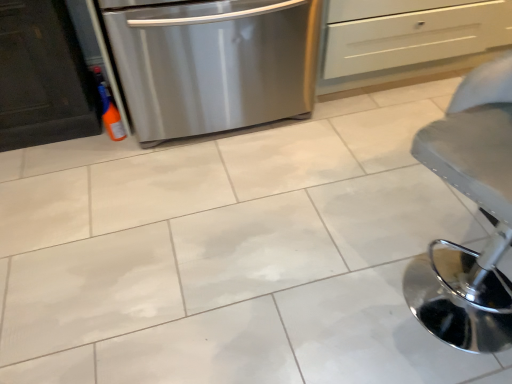
Question: Does metallic gray stool at lower right have a larger size compared to white matte drawer at upper center?

Choices:
 (A) no
 (B) yes

Answer: (A)

Question: From a real-world perspective, does metallic gray stool at lower right stand above white matte drawer at upper center?

Choices:
 (A) no
 (B) yes

Answer: (B)

Question: Is metallic gray stool at lower right oriented towards white matte drawer at upper center?

Choices:
 (A) no
 (B) yes

Answer: (A)

Question: Is metallic gray stool at lower right not within white matte drawer at upper center?

Choices:
 (A) no
 (B) yes

Answer: (B)

Question: Is metallic gray stool at lower right in front of white matte drawer at upper center?

Choices:
 (A) no
 (B) yes

Answer: (B)

Question: In terms of width, does stainless steel dishwasher at left look wider or thinner when compared to metallic gray stool at lower right?

Choices:
 (A) wide
 (B) thin

Answer: (A)

Question: From a real-world perspective, is stainless steel dishwasher at left above or below metallic gray stool at lower right?

Choices:
 (A) above
 (B) below

Answer: (B)

Question: Considering their positions, is stainless steel dishwasher at left located in front of or behind metallic gray stool at lower right?

Choices:
 (A) behind
 (B) front

Answer: (A)

Question: Considering the positions of point (166, 43) and point (502, 91), is point (166, 43) closer or farther from the camera than point (502, 91)?

Choices:
 (A) farther
 (B) closer

Answer: (A)

Question: From the image's perspective, is metallic gray stool at lower right positioned above or below stainless steel dishwasher at left?

Choices:
 (A) below
 (B) above

Answer: (A)

Question: Is point (494, 122) positioned closer to the camera than point (202, 107)?

Choices:
 (A) farther
 (B) closer

Answer: (B)

Question: Is metallic gray stool at lower right spatially inside stainless steel dishwasher at left, or outside of it?

Choices:
 (A) inside
 (B) outside

Answer: (B)

Question: Is metallic gray stool at lower right wider or thinner than stainless steel dishwasher at left?

Choices:
 (A) thin
 (B) wide

Answer: (A)

Question: From a real-world perspective, is white matte drawer at upper center above or below stainless steel dishwasher at left?

Choices:
 (A) above
 (B) below

Answer: (B)

Question: Based on their sizes in the image, would you say white matte drawer at upper center is bigger or smaller than stainless steel dishwasher at left?

Choices:
 (A) big
 (B) small

Answer: (B)